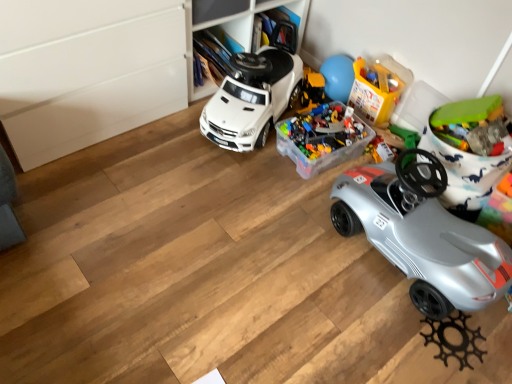
Question: Does translucent plastic container at upper center, the 2th toy viewed from the right, have a larger size compared to silver metallic car at lower right, the 2th car viewed from the left?

Choices:
 (A) no
 (B) yes

Answer: (A)

Question: From the image's perspective, is translucent plastic container at upper center, arranged as the 2th toy when viewed from the left, below silver metallic car at lower right, placed as the first car when sorted from right to left?

Choices:
 (A) no
 (B) yes

Answer: (A)

Question: From a real-world perspective, is translucent plastic container at upper center, arranged as the 2th toy when viewed from the left, on silver metallic car at lower right, placed as the first car when sorted from right to left?

Choices:
 (A) no
 (B) yes

Answer: (A)

Question: Could silver metallic car at lower right, placed as the first car when sorted from right to left, be considered to be inside translucent plastic container at upper center, arranged as the 2th toy when viewed from the left?

Choices:
 (A) yes
 (B) no

Answer: (B)

Question: Is the depth of translucent plastic container at upper center, the 2th toy viewed from the right, less than that of silver metallic car at lower right, placed as the first car when sorted from right to left?

Choices:
 (A) no
 (B) yes

Answer: (A)

Question: Is point (305, 172) positioned closer to the camera than point (401, 74)?

Choices:
 (A) farther
 (B) closer

Answer: (B)

Question: Which is correct: translucent plastic container at center, which is counted as the third toy, starting from the right, is inside translucent plastic container at upper center, arranged as the 2th toy when viewed from the left, or outside of it?

Choices:
 (A) inside
 (B) outside

Answer: (B)

Question: Based on their sizes in the image, would you say translucent plastic container at center, which is counted as the third toy, starting from the right, is bigger or smaller than translucent plastic container at upper center, arranged as the 2th toy when viewed from the left?

Choices:
 (A) big
 (B) small

Answer: (A)

Question: Is translucent plastic container at center, the 1th toy positioned from the left, to the left or to the right of translucent plastic container at upper center, arranged as the 2th toy when viewed from the left, in the image?

Choices:
 (A) right
 (B) left

Answer: (B)

Question: Is green plastic toy at upper right, marked as the third toy in a left-to-right arrangement, taller or shorter than translucent plastic container at center, which is counted as the third toy, starting from the right?

Choices:
 (A) tall
 (B) short

Answer: (B)

Question: Considering the positions of point (462, 135) and point (351, 147), is point (462, 135) closer or farther from the camera than point (351, 147)?

Choices:
 (A) closer
 (B) farther

Answer: (A)

Question: Based on their sizes in the image, would you say green plastic toy at upper right, the first toy in the right-to-left sequence, is bigger or smaller than translucent plastic container at center, the 1th toy positioned from the left?

Choices:
 (A) small
 (B) big

Answer: (A)

Question: From a real-world perspective, relative to translucent plastic container at center, the 1th toy positioned from the left, is green plastic toy at upper right, the first toy in the right-to-left sequence, vertically above or below?

Choices:
 (A) above
 (B) below

Answer: (A)

Question: Is silver metallic car at lower right, the 2th car viewed from the left, to the left or to the right of translucent plastic container at center, which is counted as the third toy, starting from the right, in the image?

Choices:
 (A) left
 (B) right

Answer: (B)

Question: Is silver metallic car at lower right, the 2th car viewed from the left, taller or shorter than translucent plastic container at center, which is counted as the third toy, starting from the right?

Choices:
 (A) short
 (B) tall

Answer: (B)